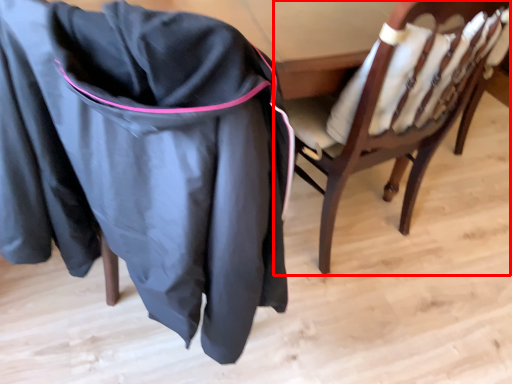
Question: Considering the relative positions of chair (annotated by the red box) and clothing in the image provided, where is chair (annotated by the red box) located with respect to the staircase?

Choices:
 (A) right
 (B) left

Answer: (A)